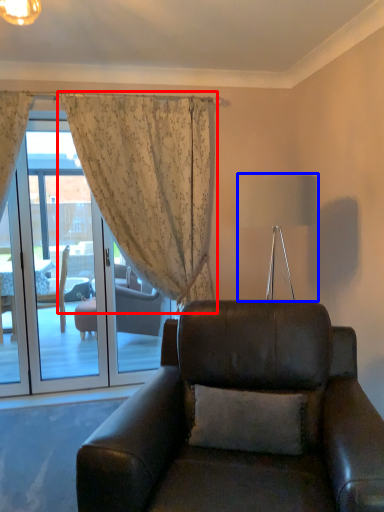
Question: Which of the following is the closest to the observer, curtain (highlighted by a red box) or lamp (highlighted by a blue box)?

Choices:
 (A) curtain
 (B) lamp

Answer: (B)